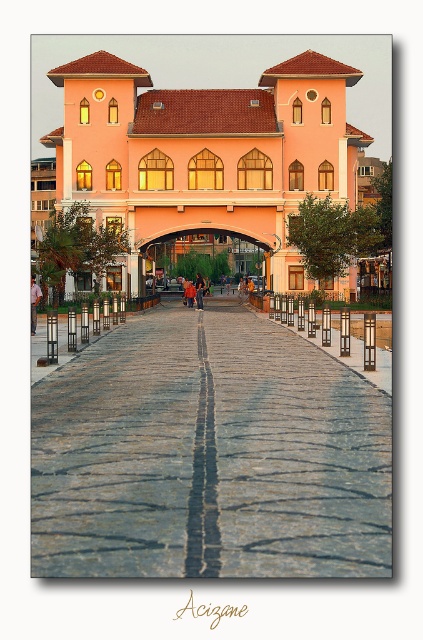
Question: Observing the image, what is the correct spatial positioning of gray cobblestone pavement at center in reference to orange fabric person at center?

Choices:
 (A) left
 (B) right

Answer: (B)

Question: Can you confirm if matte pink dress at center is bigger than orange fabric person at center?

Choices:
 (A) yes
 (B) no

Answer: (B)

Question: Is matte pink dress at center positioned before orange fabric person at center?

Choices:
 (A) yes
 (B) no

Answer: (A)

Question: Which of the following is the farthest from the observer?

Choices:
 (A) matte pink dress at center
 (B) gray cobblestone pavement at center

Answer: (A)

Question: Which point is farther to the camera?

Choices:
 (A) (197, 304)
 (B) (343, 540)

Answer: (A)

Question: Which of the following is the closest to the observer?

Choices:
 (A) (118, 381)
 (B) (30, 324)

Answer: (A)